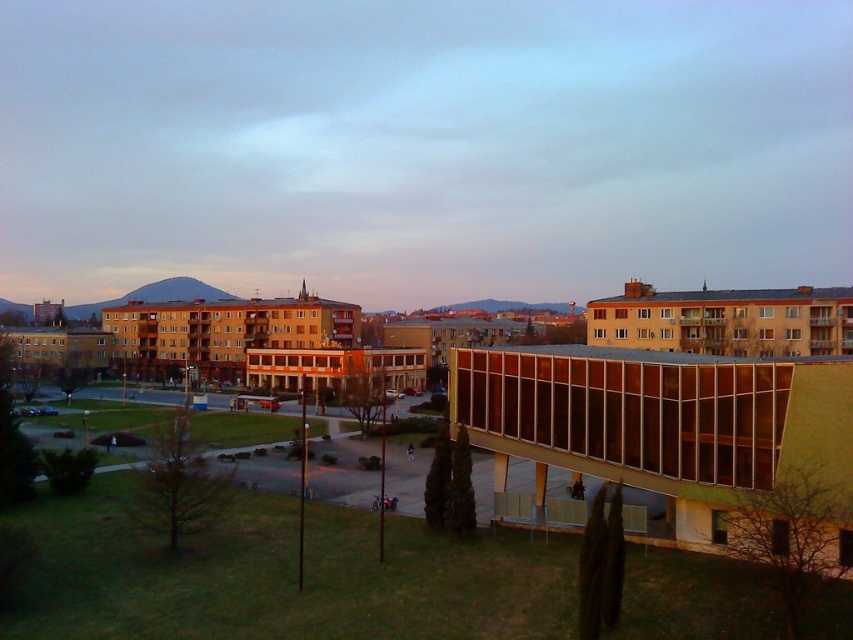
Between matte orange building at center and translucent glass building at center, which one has less height?

Standing shorter between the two is translucent glass building at center.

Between matte orange building at center and translucent glass building at center, which one appears on the left side from the viewer's perspective?

matte orange building at center

Does point (136, 188) lie behind point (608, 435)?

Yes, it is.

Locate an element on the screen. Image resolution: width=853 pixels, height=640 pixels. matte orange building at center is located at coordinates (422, 145).